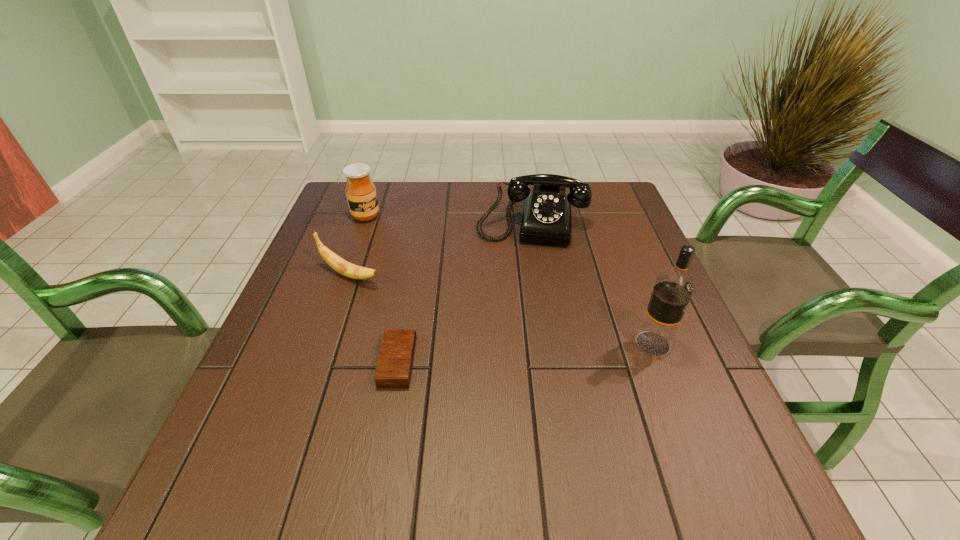
Identify the location of free space on the desktop that is between the third object from right to left and the rightmost object and is positioned on the dial of the second object from right to left. (516, 353).

Find the location of `vacant spot on the desktop that is between the third object from left to right and the rightmost object and is positioned on the front-facing side of the honey`. vacant spot on the desktop that is between the third object from left to right and the rightmost object and is positioned on the front-facing side of the honey is located at coordinates [x=551, y=351].

Identify the location of vacant space on the desktop that is between the shortest object and the vodka and is positioned on the peel of the third farthest object from the top. Image resolution: width=960 pixels, height=540 pixels. (525, 353).